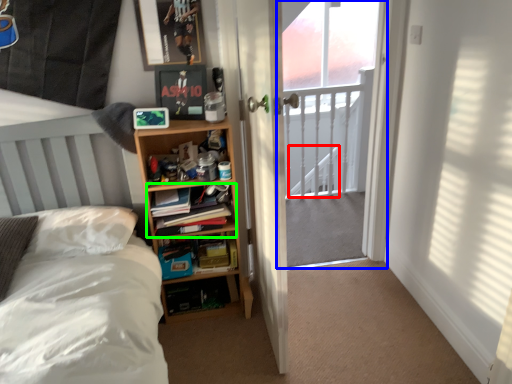
Question: Estimate the real-world distances between objects in this image. Which object is closer to stairwell (highlighted by a red box), screen door (highlighted by a blue box) or book (highlighted by a green box)?

Choices:
 (A) screen door
 (B) book

Answer: (A)